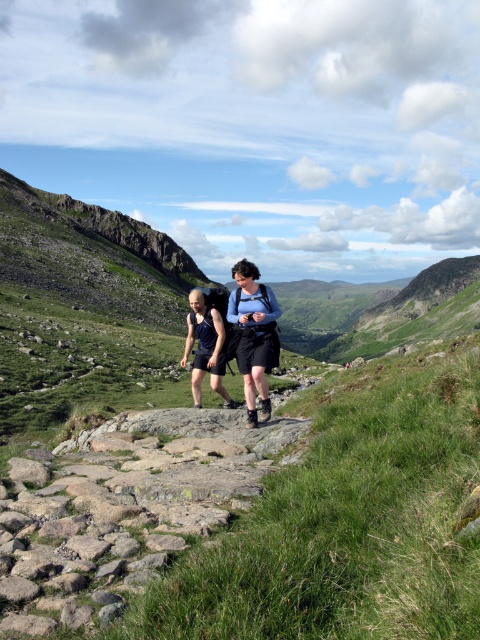
Question: Is matte blue backpack at center to the right of matte black shorts at center from the viewer's perspective?

Choices:
 (A) yes
 (B) no

Answer: (A)

Question: Is matte blue backpack at center further to the viewer compared to matte black shorts at center?

Choices:
 (A) no
 (B) yes

Answer: (A)

Question: Can you confirm if green grassy at center is bigger than matte black shorts at center?

Choices:
 (A) no
 (B) yes

Answer: (A)

Question: Estimate the real-world distances between objects in this image. Which object is farther from the matte black shorts at center?

Choices:
 (A) matte blue backpack at center
 (B) green grassy at center

Answer: (B)

Question: Considering the real-world distances, which object is closest to the green grassy at center?

Choices:
 (A) matte black shorts at center
 (B) matte blue backpack at center

Answer: (B)

Question: Which object appears farthest from the camera in this image?

Choices:
 (A) matte black shorts at center
 (B) matte blue backpack at center
 (C) green grassy at center

Answer: (A)